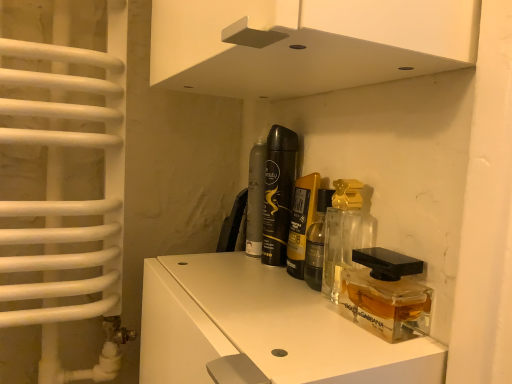
Question: From the image's perspective, is translucent glass perfume at center, the 2th perfume when ordered from back to front, above clear glass perfume at center, placed as the 3th perfume when sorted from back to front?

Choices:
 (A) yes
 (B) no

Answer: (A)

Question: Is translucent glass perfume at center, the 2th perfume when ordered from back to front, taller than clear glass perfume at center, placed as the 3th perfume when sorted from back to front?

Choices:
 (A) yes
 (B) no

Answer: (A)

Question: Does translucent glass perfume at center, placed as the third perfume when sorted from front to back, have a larger size compared to clear glass perfume at center, the second perfume when ordered from front to back?

Choices:
 (A) yes
 (B) no

Answer: (A)

Question: Is the position of translucent glass perfume at center, the 2th perfume when ordered from back to front, less distant than that of clear glass perfume at center, the second perfume when ordered from front to back?

Choices:
 (A) yes
 (B) no

Answer: (B)

Question: Does translucent glass perfume at center, the 2th perfume when ordered from back to front, appear on the left side of clear glass perfume at center, the second perfume when ordered from front to back?

Choices:
 (A) yes
 (B) no

Answer: (A)

Question: Considering the relative positions of transparent plastic perfume bottle at center and translucent glass perfume at center, placed as the third perfume when sorted from front to back, in the image provided, is transparent plastic perfume bottle at center to the left or to the right of translucent glass perfume at center, placed as the third perfume when sorted from front to back,?

Choices:
 (A) right
 (B) left

Answer: (A)

Question: From a real-world perspective, is transparent plastic perfume bottle at center positioned above or below translucent glass perfume at center, placed as the third perfume when sorted from front to back?

Choices:
 (A) below
 (B) above

Answer: (A)

Question: Is transparent plastic perfume bottle at center spatially inside translucent glass perfume at center, the 2th perfume when ordered from back to front, or outside of it?

Choices:
 (A) inside
 (B) outside

Answer: (B)

Question: Is transparent plastic perfume bottle at center bigger or smaller than translucent glass perfume at center, placed as the third perfume when sorted from front to back?

Choices:
 (A) small
 (B) big

Answer: (A)

Question: Choose the correct answer: Is translucent glass perfume at center, the 2th perfume when ordered from back to front, inside transparent plastic perfume bottle at center or outside it?

Choices:
 (A) outside
 (B) inside

Answer: (A)

Question: From the image's perspective, is translucent glass perfume at center, placed as the third perfume when sorted from front to back, positioned above or below transparent plastic perfume bottle at center?

Choices:
 (A) above
 (B) below

Answer: (A)

Question: Is translucent glass perfume at center, the 2th perfume when ordered from back to front, taller or shorter than transparent plastic perfume bottle at center?

Choices:
 (A) short
 (B) tall

Answer: (B)

Question: Based on their sizes in the image, would you say translucent glass perfume at center, placed as the third perfume when sorted from front to back, is bigger or smaller than transparent plastic perfume bottle at center?

Choices:
 (A) small
 (B) big

Answer: (B)

Question: In terms of height, does translucent glass perfume at center, the 2th perfume when ordered from back to front, look taller or shorter compared to matte black perfume at center, the fourth perfume when ordered from front to back?

Choices:
 (A) tall
 (B) short

Answer: (A)

Question: In the image, is translucent glass perfume at center, the 2th perfume when ordered from back to front, positioned in front of or behind matte black perfume at center, the fourth perfume when ordered from front to back?

Choices:
 (A) front
 (B) behind

Answer: (A)